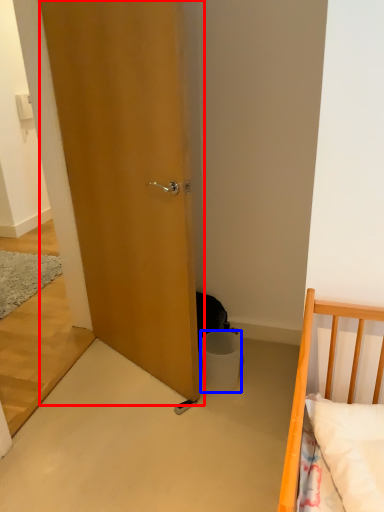
Question: Which object is closer to the camera taking this photo, door (highlighted by a red box) or trash bin/can (highlighted by a blue box)?

Choices:
 (A) door
 (B) trash bin/can

Answer: (A)